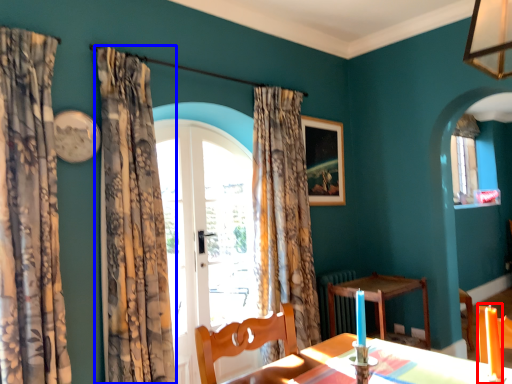
Question: Which object is further to the camera taking this photo, candle (highlighted by a red box) or curtain (highlighted by a blue box)?

Choices:
 (A) candle
 (B) curtain

Answer: (B)